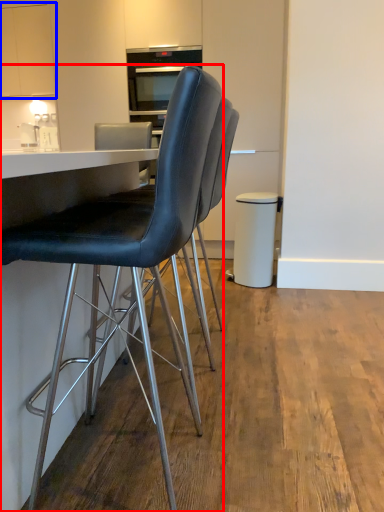
Question: Which of the following is the closest to the observer, chair (highlighted by a red box) or cabinetry (highlighted by a blue box)?

Choices:
 (A) chair
 (B) cabinetry

Answer: (A)